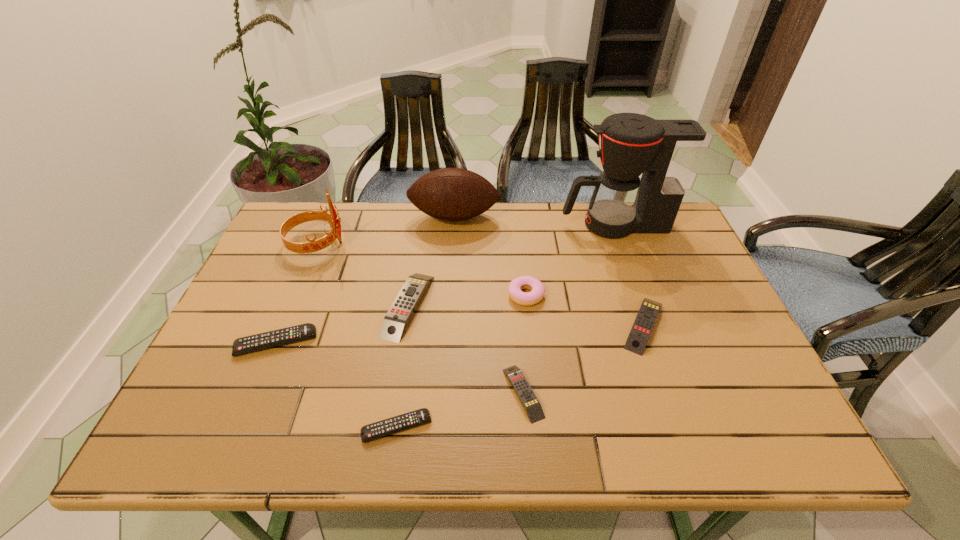
Locate an element on the screen. The height and width of the screenshot is (540, 960). the bigger black remote control is located at coordinates (247, 344).

The width and height of the screenshot is (960, 540). Find the location of `the second yellow remote control from right to left`. the second yellow remote control from right to left is located at coordinates (527, 397).

At what (x,y) coordinates should I click in order to perform the action: click on the nearest yellow remote control. Please return your answer as a coordinate pair (x, y). Image resolution: width=960 pixels, height=540 pixels. Looking at the image, I should click on (527, 397).

What are the coordinates of `the smaller black remote control` in the screenshot? It's located at pos(372,431).

Locate an element on the screen. the nearer black remote control is located at coordinates (372, 431).

Where is `vacant space located pour from the carafe of the tallest object`? vacant space located pour from the carafe of the tallest object is located at coordinates (530, 225).

You are a GUI agent. You are given a task and a screenshot of the screen. Output one action in this format:
    pyautogui.click(x=<x>, y=<y>)
    Task: Click on the free space located 0.200m pour from the carafe of the tallest object
    Image resolution: width=960 pixels, height=540 pixels.
    Given the screenshot: What is the action you would take?
    pyautogui.click(x=498, y=225)

The image size is (960, 540). In order to click on vacant space positioned 0.120m pour from the carafe of the tallest object in this screenshot , I will do `click(523, 225)`.

You are a GUI agent. You are given a task and a screenshot of the screen. Output one action in this format:
    pyautogui.click(x=<x>, y=<y>)
    Task: Click on the free space located 0.260m on the front-facing side of the tiara
    Image resolution: width=960 pixels, height=540 pixels.
    Given the screenshot: What is the action you would take?
    pyautogui.click(x=433, y=244)

Find the location of a particular element. The width and height of the screenshot is (960, 540). free space located on the laces of the third tallest object is located at coordinates (451, 265).